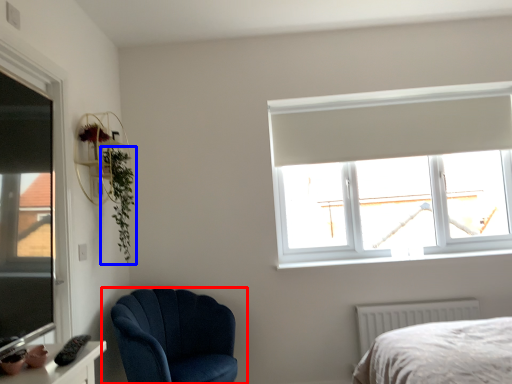
Question: Which object appears farthest to the camera in this image, chair (highlighted by a red box) or plant (highlighted by a blue box)?

Choices:
 (A) chair
 (B) plant

Answer: (B)